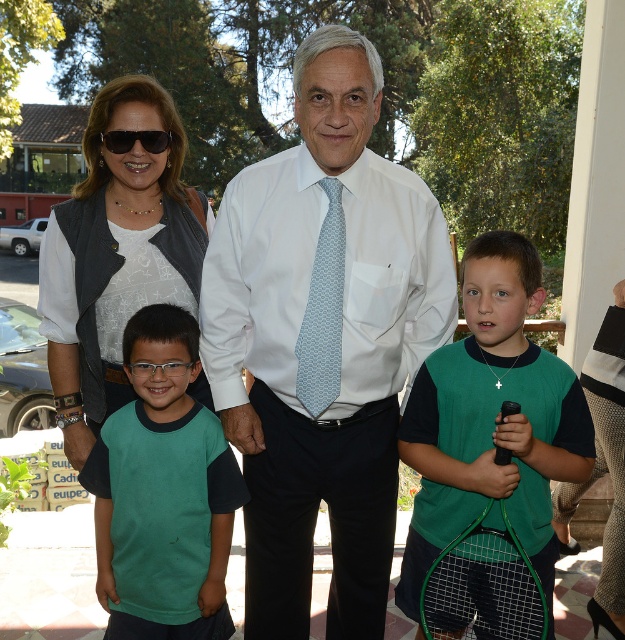
Consider the image. Based on the scene description, can you determine if the green mesh tennis racket at lower center is located below the black plastic sunglasses at upper left?

Yes, the green mesh tennis racket at lower center is positioned under black plastic sunglasses at upper left, so it is located below it.

You are trying to decide which item is wider between the green mesh tennis racket at lower center and the black plastic sunglasses at upper left. Based on the scene, which one is wider?

The green mesh tennis racket at lower center is wider than the black plastic sunglasses at upper left according to the description.